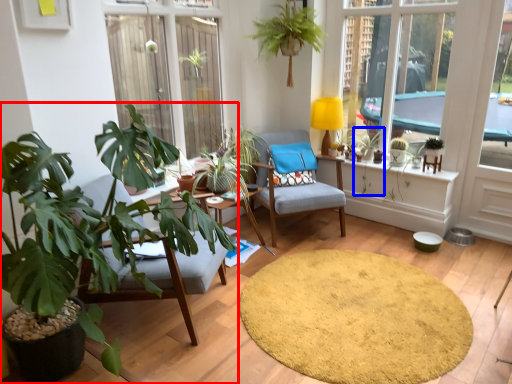
Question: Which of the following is the farthest to the observer, houseplant (highlighted by a red box) or plant (highlighted by a blue box)?

Choices:
 (A) houseplant
 (B) plant

Answer: (B)